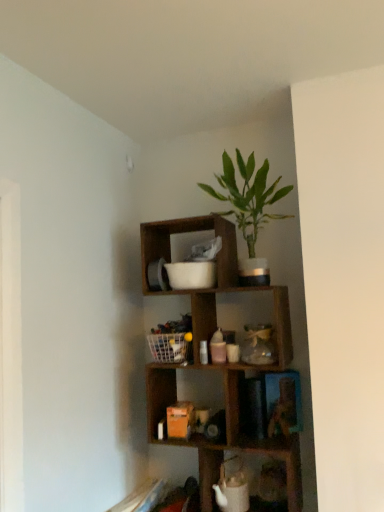
This screenshot has width=384, height=512. Describe the element at coordinates (172, 340) in the screenshot. I see `white mesh basket at center` at that location.

What is the approximate height of green leafy plant in pot at upper center?

The height of green leafy plant in pot at upper center is 23.94 inches.

Describe the element at coordinates (228, 362) in the screenshot. The height and width of the screenshot is (512, 384). I see `wooden cube at upper center` at that location.

Where is `white mesh basket at center`? The image size is (384, 512). white mesh basket at center is located at coordinates (172, 340).

Consider the image. Visually, is wooden cube at upper center positioned to the left or to the right of white mesh basket at center?

wooden cube at upper center is positioned on white mesh basket at center's right side.

Is wooden cube at upper center oriented towards white mesh basket at center?

Yes.

You are a GUI agent. You are given a task and a screenshot of the screen. Output one action in this format:
    pyautogui.click(x=<x>, y=<y>)
    Task: Click on the shelf in front of the white mesh basket at center
    The image size is (384, 512).
    Given the screenshot: What is the action you would take?
    pyautogui.click(x=228, y=362)

Is wooden cube at upper center located outside white mesh basket at center?

wooden cube at upper center lies outside white mesh basket at center's area.

Which is closer to the camera, (183, 340) or (243, 162)?

Point (183, 340).

Between white mesh basket at center and green leafy plant in pot at upper center, which one has more height?

green leafy plant in pot at upper center.

Is white mesh basket at center looking in the opposite direction of green leafy plant in pot at upper center?

No, white mesh basket at center is not facing the opposite direction of green leafy plant in pot at upper center.

Where is `houseplant to the right of white mesh basket at center`? The image size is (384, 512). houseplant to the right of white mesh basket at center is located at coordinates (248, 196).

Can you confirm if green leafy plant in pot at upper center is bigger than white mesh basket at center?

Yes, green leafy plant in pot at upper center is bigger than white mesh basket at center.

This screenshot has height=512, width=384. I want to click on houseplant lying above the white mesh basket at center (from the image's perspective), so click(x=248, y=196).

Which object is closer to the camera taking this photo, green leafy plant in pot at upper center or white mesh basket at center?

green leafy plant in pot at upper center.

Between green leafy plant in pot at upper center and white mesh basket at center, which one appears on the left side from the viewer's perspective?

From the viewer's perspective, white mesh basket at center appears more on the left side.

Is wooden cube at upper center surrounded by white mesh basket at center?

Actually, wooden cube at upper center is outside white mesh basket at center.

At what (x,y) coordinates should I click in order to perform the action: click on cabinet behind the wooden cube at upper center. Please return your answer as a coordinate pair (x, y). The height and width of the screenshot is (512, 384). Looking at the image, I should click on tap(172, 340).

Does white mesh basket at center turn towards wooden cube at upper center?

Yes, white mesh basket at center is turned towards wooden cube at upper center.

From a real-world perspective, does white mesh basket at center stand above wooden cube at upper center?

Yes, from a real-world perspective, white mesh basket at center is on top of wooden cube at upper center.

Is green leafy plant in pot at upper center situated inside wooden cube at upper center or outside?

green leafy plant in pot at upper center is located beyond the bounds of wooden cube at upper center.

Are green leafy plant in pot at upper center and wooden cube at upper center located far from each other?

No, green leafy plant in pot at upper center is not far away from wooden cube at upper center.

Considering the sizes of objects green leafy plant in pot at upper center and wooden cube at upper center in the image provided, who is taller, green leafy plant in pot at upper center or wooden cube at upper center?

wooden cube at upper center is taller.

From the image's perspective, which object appears higher, wooden cube at upper center or green leafy plant in pot at upper center?

green leafy plant in pot at upper center appears higher in the image.

Considering the positions of objects wooden cube at upper center and green leafy plant in pot at upper center in the image provided, who is behind, wooden cube at upper center or green leafy plant in pot at upper center?

wooden cube at upper center.

Is there a large distance between wooden cube at upper center and green leafy plant in pot at upper center?

No, wooden cube at upper center is in close proximity to green leafy plant in pot at upper center.

Is wooden cube at upper center positioned with its back to green leafy plant in pot at upper center?

No, green leafy plant in pot at upper center is not at the back of wooden cube at upper center.

Where is `shelf below the white mesh basket at center (from the image's perspective)`? The width and height of the screenshot is (384, 512). shelf below the white mesh basket at center (from the image's perspective) is located at coordinates (228, 362).

Locate an element on the screen. The height and width of the screenshot is (512, 384). houseplant above the white mesh basket at center (from the image's perspective) is located at coordinates (248, 196).

Estimate the real-world distances between objects in this image. Which object is further from white mesh basket at center, wooden cube at upper center or green leafy plant in pot at upper center?

green leafy plant in pot at upper center is positioned further to the anchor white mesh basket at center.

Estimate the real-world distances between objects in this image. Which object is closer to green leafy plant in pot at upper center, wooden cube at upper center or white mesh basket at center?

Among the two, wooden cube at upper center is located nearer to green leafy plant in pot at upper center.

When comparing their distances from wooden cube at upper center, does green leafy plant in pot at upper center or white mesh basket at center seem closer?

Among the two, white mesh basket at center is located nearer to wooden cube at upper center.

From the picture: From the image, which object appears to be nearer to green leafy plant in pot at upper center, white mesh basket at center or wooden cube at upper center?

wooden cube at upper center is positioned closer to the anchor green leafy plant in pot at upper center.

Consider the image. Considering their positions, is white mesh basket at center positioned further to wooden cube at upper center than green leafy plant in pot at upper center?

green leafy plant in pot at upper center.

Which object lies further to the anchor point white mesh basket at center, green leafy plant in pot at upper center or wooden cube at upper center?

Based on the image, green leafy plant in pot at upper center appears to be further to white mesh basket at center.

Identify the location of cabinet between green leafy plant in pot at upper center and wooden cube at upper center in the up-down direction. (172, 340).